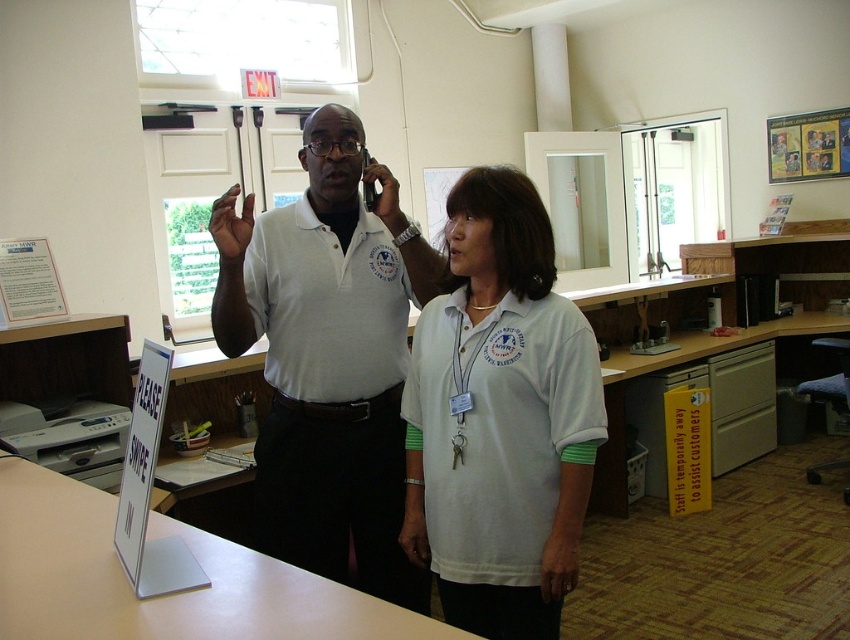
You are an office manager who needs to ensure proper attire for a photoshoot. Both the white cotton shirt at center and the white matte shirt at center are available. Which shirt should you choose if you want the one that is smaller in size?

The white cotton shirt at center is smaller than the white matte shirt at center, so you should choose the white cotton shirt at center for the photoshoot.

You are designing a layout for a magazine spread featuring two people wearing different shirts. The white cotton shirt at center and the white matte shirt at center are positioned side by side. Which shirt takes up more horizontal space in the photo?

The white matte shirt at center takes up more horizontal space because it has a greater width than the white cotton shirt at center.